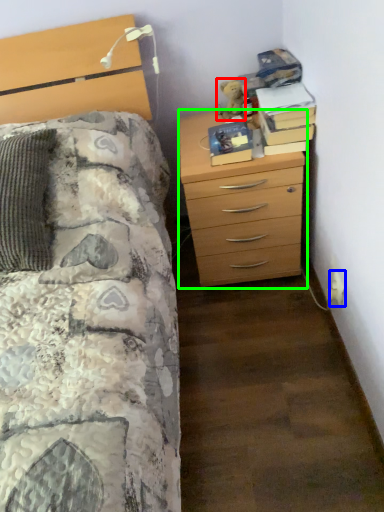
Question: Which object is the farthest from teddy (highlighted by a red box)? Choose among these: electric outlet (highlighted by a blue box) or chest of drawers (highlighted by a green box).

Choices:
 (A) electric outlet
 (B) chest of drawers

Answer: (A)